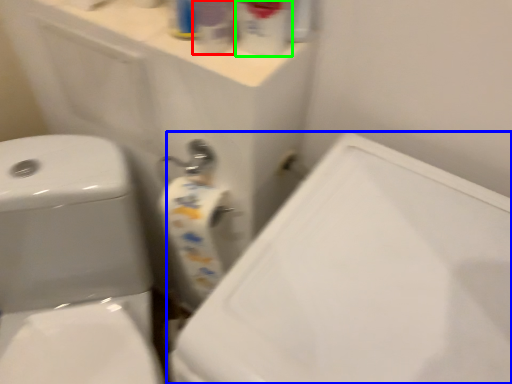
Question: Which object is positioned farthest from cleaning product (highlighted by a red box)? Select from porcelain (highlighted by a blue box) and cleaning product (highlighted by a green box).

Choices:
 (A) porcelain
 (B) cleaning product

Answer: (A)